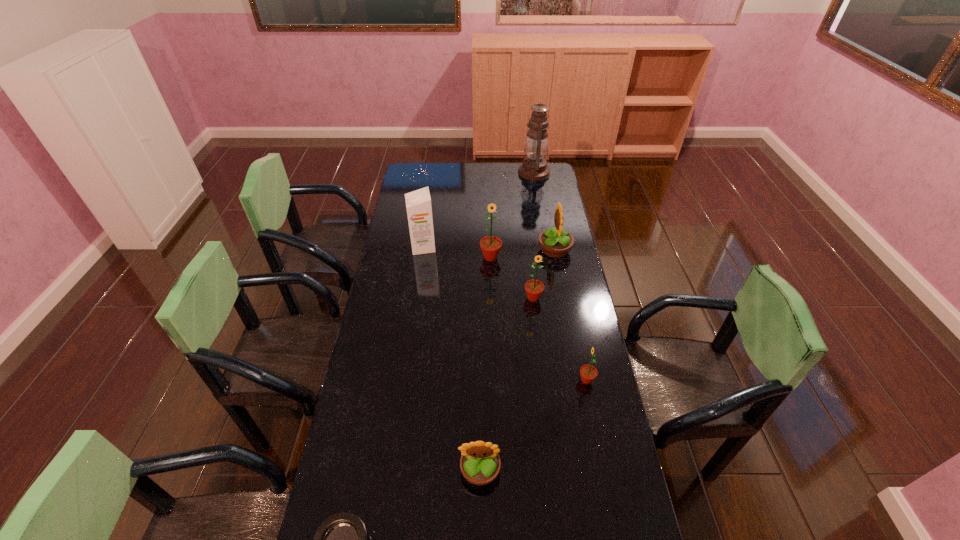
The height and width of the screenshot is (540, 960). In the image, there is a desktop. Identify the location of blank space at the right edge. (592, 444).

Where is `free point at the far left corner`? free point at the far left corner is located at coordinates tap(405, 171).

Where is `vacant space at the far right corner of the desktop`? This screenshot has width=960, height=540. vacant space at the far right corner of the desktop is located at coordinates (556, 177).

This screenshot has width=960, height=540. Identify the location of vacant area that lies between the farthest object and the carton. (479, 210).

Identify the location of blank region between the left yellow sunflower and the farther yellow sunflower. (517, 360).

You are a GUI agent. You are given a task and a screenshot of the screen. Output one action in this format:
    pyautogui.click(x=<x>, y=<y>)
    Task: Click on the vacant point located between the seventh farthest object and the sixth farthest object
    This screenshot has width=960, height=540.
    Given the screenshot: What is the action you would take?
    pyautogui.click(x=533, y=425)

In order to click on empty space between the fifth farthest object and the leftmost green sunflower in this screenshot , I will do `click(512, 278)`.

In order to click on empty space between the tallest sunflower and the farthest object in this screenshot , I will do `click(513, 215)`.

The image size is (960, 540). Find the location of `object identified as the second closest to the tallest object`. object identified as the second closest to the tallest object is located at coordinates (490, 245).

Select which object is the fifth closest to the oil lamp. Please provide its 2D coordinates. Your answer should be formatted as a tuple, i.e. [(x, y)], where the tuple contains the x and y coordinates of a point satisfying the conditions above.

[(588, 373)]